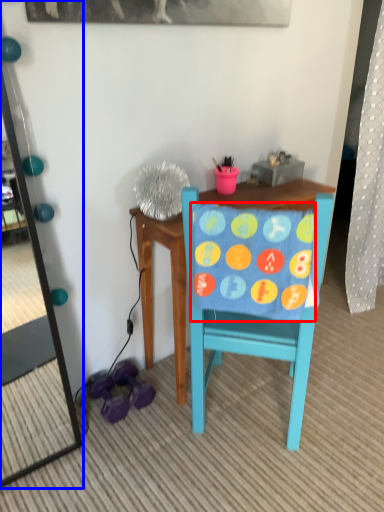
Question: Which of the following is the farthest to the observer, blanket (highlighted by a red box) or mirror (highlighted by a blue box)?

Choices:
 (A) blanket
 (B) mirror

Answer: (A)